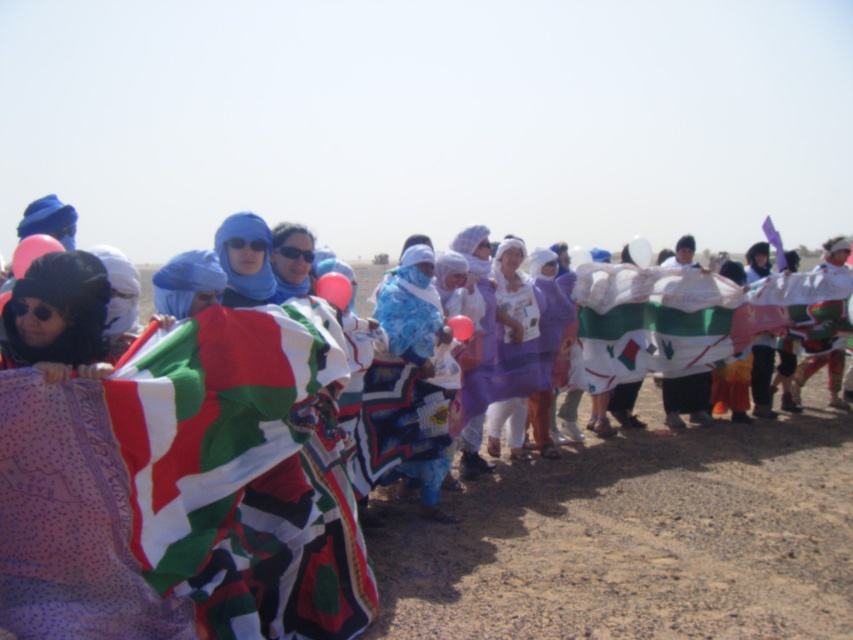
In the scene shown: You are a photographer trying to capture the group in the desert. You notice the printed fabric scarf at center and the purple fabric at center. Which fabric should you focus on to ensure it appears above the other in your photo?

The printed fabric scarf at center is positioned under the purple fabric at center, so focusing on the purple fabric at center will ensure it appears above the other in the photo.

You are a photographer trying to capture a closeup shot of the printed fabric scarf at center and the purple fabric at center. Which fabric should you zoom in on if you want to focus on the wider one?

The printed fabric scarf at center might be wider than purple fabric at center, so you should zoom in on the printed fabric scarf at center to focus on the wider one.

You are standing in the desert scene and want to take a photo of both the point at (809, 588) and the point at (531, 346). Which point should you focus on first to ensure both are in clear view?

You should focus on point (809, 588) first since it is closer to the camera than point (531, 346), ensuring both points are in focus when using a shallow depth of field.